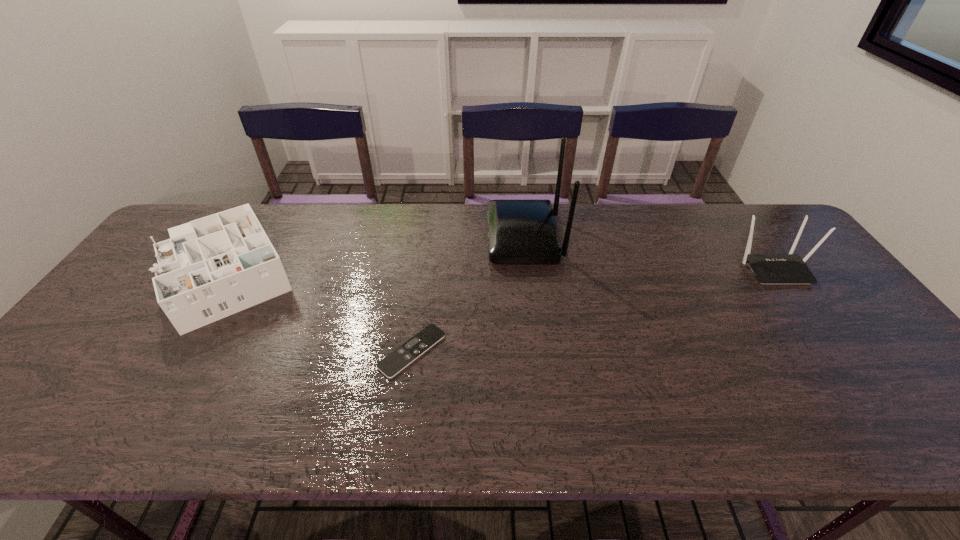
Where is `the tallest object`? The height and width of the screenshot is (540, 960). the tallest object is located at coordinates (519, 231).

In order to click on the third object from left to right in this screenshot , I will do `click(519, 231)`.

The height and width of the screenshot is (540, 960). In order to click on the right router in this screenshot , I will do `click(789, 268)`.

Locate an element on the screen. the shorter router is located at coordinates (789, 268).

The width and height of the screenshot is (960, 540). I want to click on the second shortest object, so click(x=212, y=267).

Identify the location of the leftmost object. This screenshot has width=960, height=540. (212, 267).

Image resolution: width=960 pixels, height=540 pixels. Identify the location of remote control. (404, 355).

What are the coordinates of `the shortest object` in the screenshot? It's located at (404, 355).

Where is `vacant space located on the front-facing side of the tallest object`? vacant space located on the front-facing side of the tallest object is located at coordinates (447, 238).

This screenshot has width=960, height=540. Identify the location of vacant area situated 0.250m on the front-facing side of the tallest object. (409, 238).